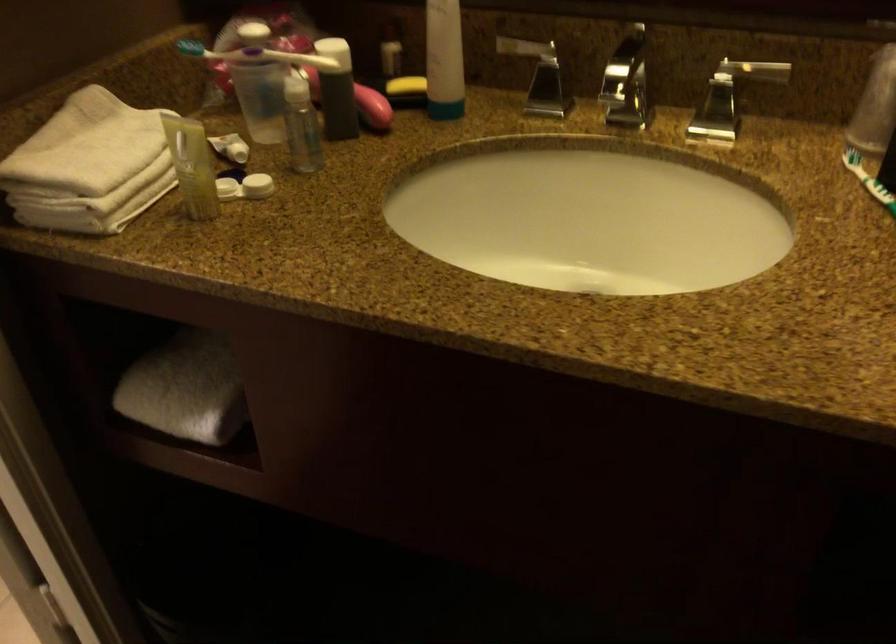
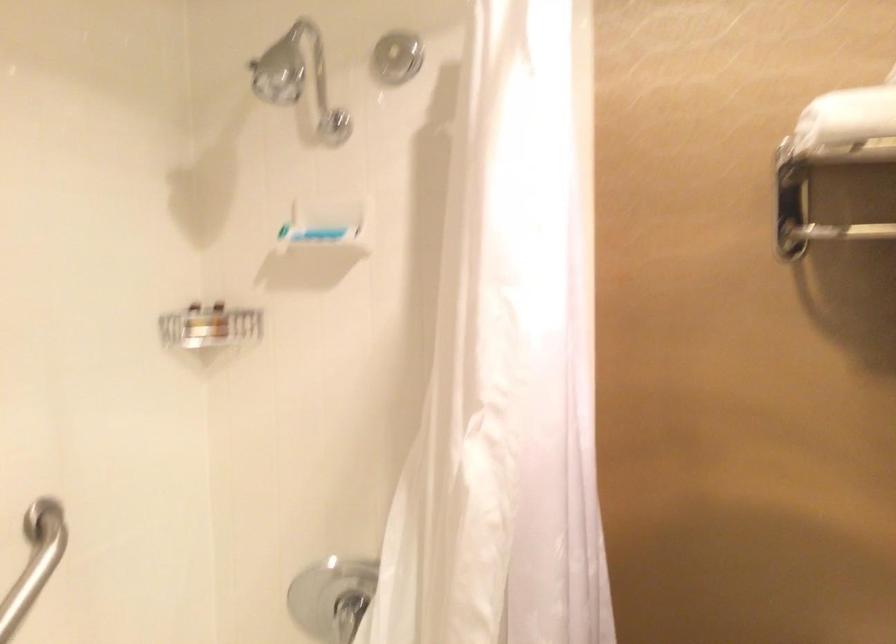
Question: The camera is either moving clockwise (left) or counter-clockwise (right) around the object. The first image is from the beginning of the video and the second image is from the end. Is the camera moving left or right when shooting the video?

Choices:
 (A) Left
 (B) Right

Answer: (B)